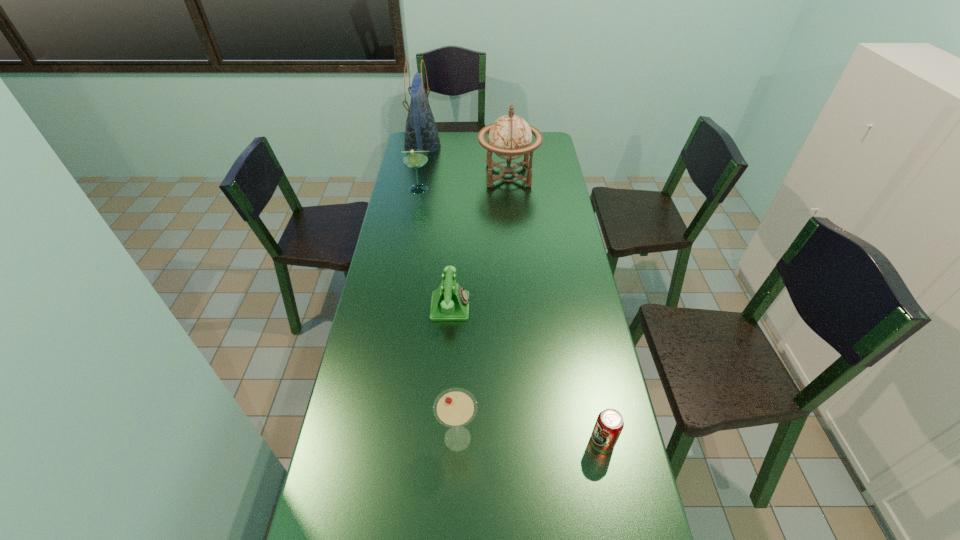
The width and height of the screenshot is (960, 540). Find the location of `shopping bag`. shopping bag is located at coordinates (421, 132).

Locate an element on the screen. The height and width of the screenshot is (540, 960). globe is located at coordinates (509, 137).

Identify the location of the left martini. Image resolution: width=960 pixels, height=540 pixels. tap(415, 158).

The height and width of the screenshot is (540, 960). Find the location of `the nearer martini`. the nearer martini is located at coordinates (455, 407).

Find the location of `the third nearest object`. the third nearest object is located at coordinates (450, 302).

Image resolution: width=960 pixels, height=540 pixels. In order to click on the rightmost object in this screenshot , I will do `click(609, 424)`.

The width and height of the screenshot is (960, 540). In order to click on free space located 0.100m on the front of the shopping bag in this screenshot , I will do `click(418, 171)`.

The height and width of the screenshot is (540, 960). In order to click on vacant space located on the front-facing side of the fifth shortest object in this screenshot , I will do `click(414, 176)`.

Locate an element on the screen. This screenshot has width=960, height=540. vacant area situated on the front-facing side of the fifth shortest object is located at coordinates (445, 176).

Identify the location of free space located on the front-facing side of the fifth shortest object. This screenshot has height=540, width=960. (438, 176).